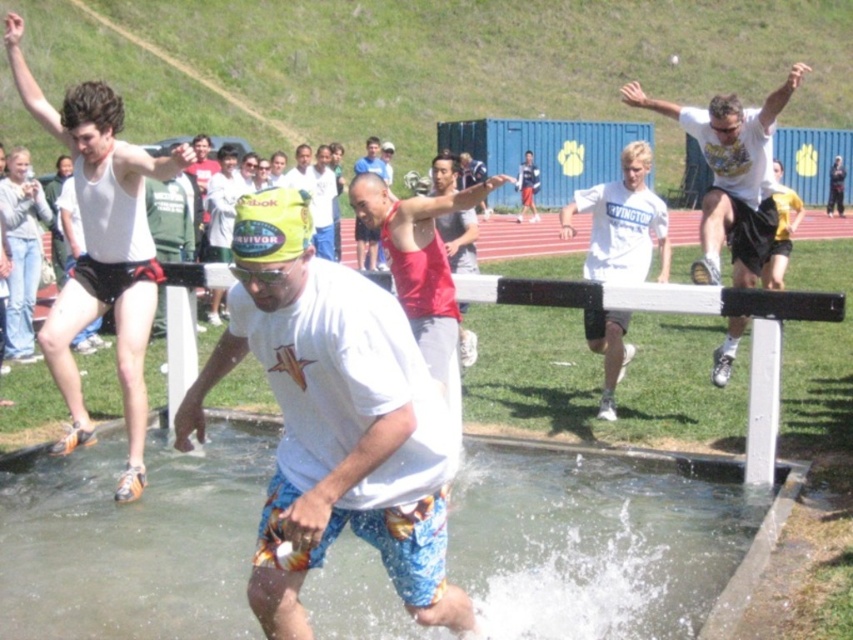
Question: Can you confirm if white matte t-shirt at upper left is positioned to the right of red tank top at center?

Choices:
 (A) yes
 (B) no

Answer: (B)

Question: Among these objects, which one is nearest to the camera?

Choices:
 (A) black plastic hurdle at center
 (B) white matte tank top at upper left

Answer: (B)

Question: Which object is positioned closest to the black plastic hurdle at center?

Choices:
 (A) white matte t-shirt at upper left
 (B) white cotton t-shirt at center
 (C) clear water at puddle center

Answer: (C)

Question: Is the position of white cotton t-shirt at center less distant than that of black plastic hurdle at center?

Choices:
 (A) yes
 (B) no

Answer: (A)

Question: Is white cotton t-shirt at center thinner than white matte tank top at upper left?

Choices:
 (A) no
 (B) yes

Answer: (A)

Question: Which of the following is the farthest from the observer?

Choices:
 (A) (746, 131)
 (B) (608, 292)
 (C) (7, 228)

Answer: (C)